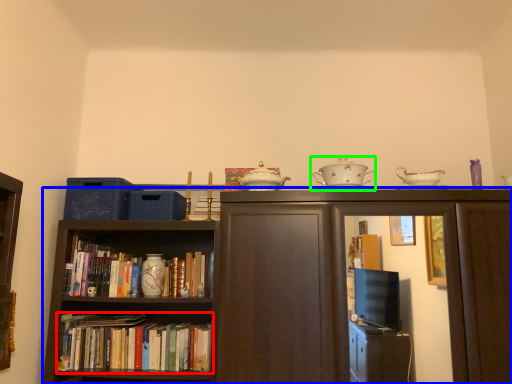
Question: Which object is positioned closest to book (highlighted by a red box)? Select from bookcase (highlighted by a blue box) and tableware (highlighted by a green box).

Choices:
 (A) bookcase
 (B) tableware

Answer: (A)